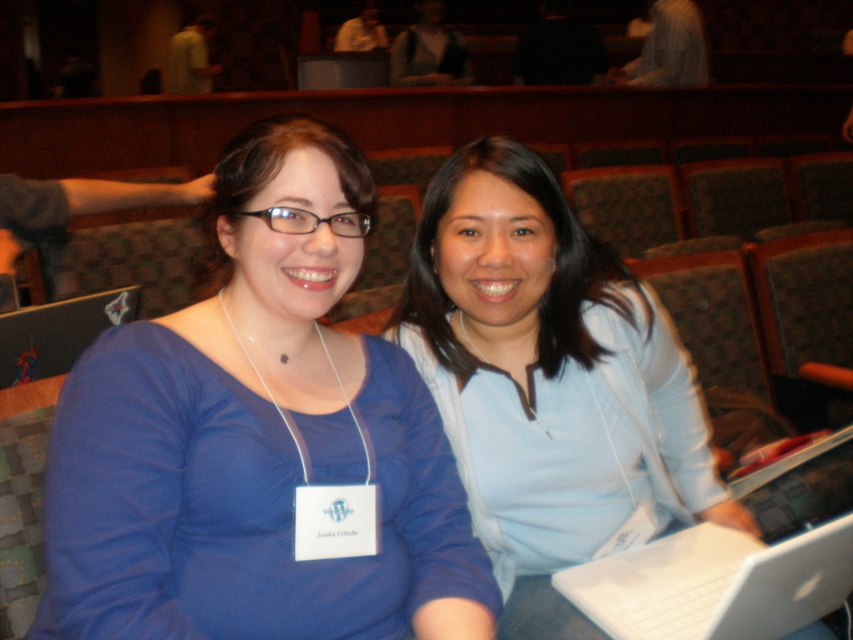
You are organizing a tech event and need to place a large monitor between the white plastic laptop at center and the matte black laptop at left. Which laptop should the monitor be placed next to to ensure it fits better?

The white plastic laptop at center is larger in size than the matte black laptop at left, so the monitor should be placed next to the white plastic laptop at center to accommodate its size.

You are organizing a photo shoot and need to ensure that the matte blue shirt at center and the matte black laptop at left are both visible in the frame. Given their sizes, which object should you prioritize positioning closer to the camera to maintain clarity?

The matte blue shirt at center is wider than the matte black laptop at left, so you should prioritize positioning the matte blue shirt at center closer to the camera to ensure both objects are clearly visible in the frame.

You are sitting in the auditorium and need to access both the white plastic laptop at center and the matte black laptop at left. Which laptop is closer to you based on their positions?

The white plastic laptop at center is closer to you because it is positioned in front of the matte black laptop at left.